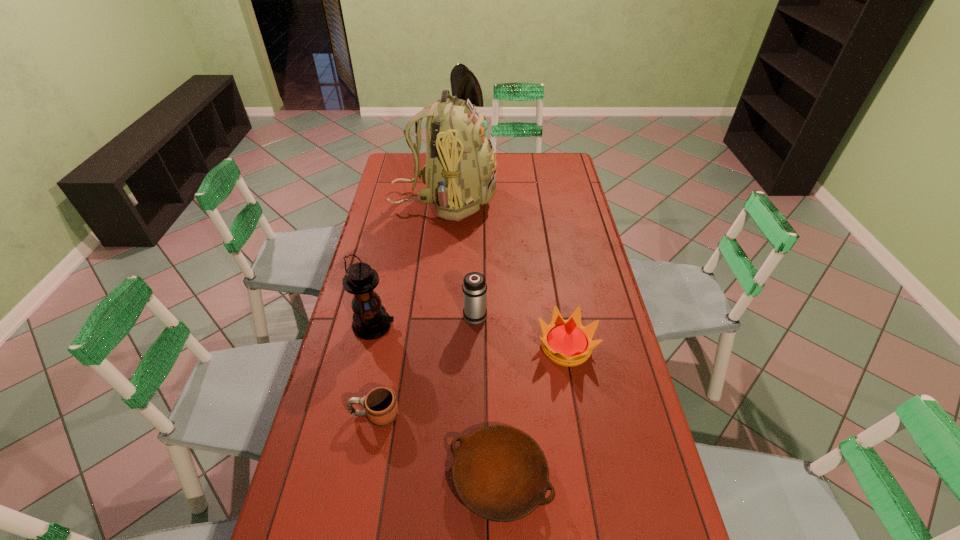
You are a GUI agent. You are given a task and a screenshot of the screen. Output one action in this format:
    pyautogui.click(x=<x>, y=<y>)
    Task: Click on the vacant space that satisfies the following two spatial constraints: 1. on the front-facing side of the crown; 2. on the left side of the tallest object
    This screenshot has width=960, height=540.
    Given the screenshot: What is the action you would take?
    pyautogui.click(x=428, y=347)

Locate an element on the screen. This screenshot has width=960, height=540. vacant area in the image that satisfies the following two spatial constraints: 1. above the nearest object, indicating its light source; 2. on the left side of the second tallest object is located at coordinates (340, 477).